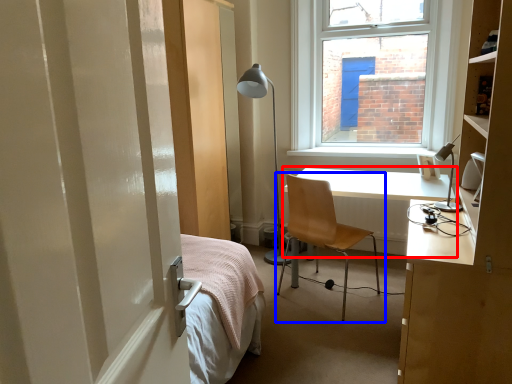
Question: Which object is further to the camera taking this photo, desk (highlighted by a red box) or chair (highlighted by a blue box)?

Choices:
 (A) desk
 (B) chair

Answer: (A)